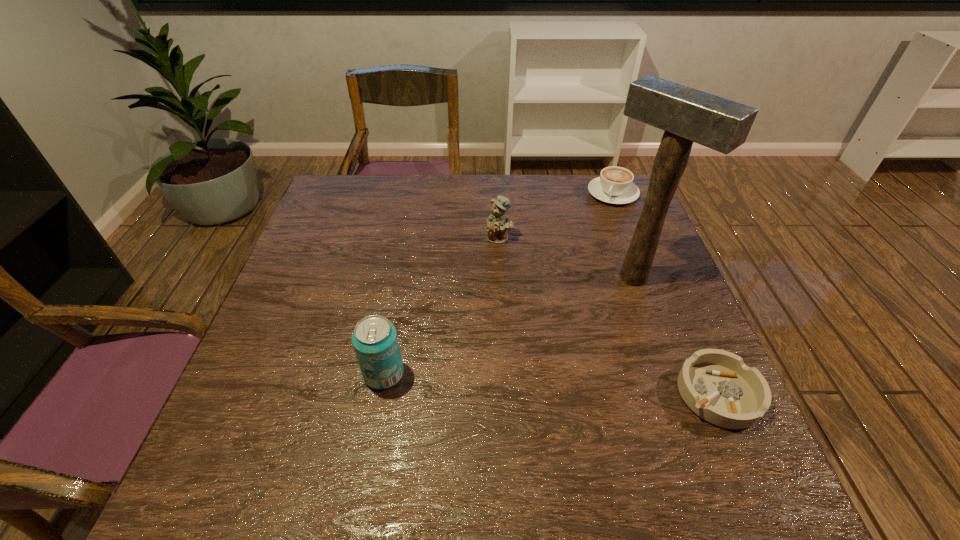
Find the location of a particular element. The height and width of the screenshot is (540, 960). free space located on the striking surface of the mallet is located at coordinates (558, 337).

Where is `free location located 0.360m on the striking surface of the mallet`? This screenshot has height=540, width=960. free location located 0.360m on the striking surface of the mallet is located at coordinates (502, 381).

Where is `blank space located on the striking surface of the mallet`? The height and width of the screenshot is (540, 960). blank space located on the striking surface of the mallet is located at coordinates (569, 328).

I want to click on blank space located 0.170m on the front-facing side of the fourth object from right to left, so click(501, 289).

Locate an element on the screen. Image resolution: width=960 pixels, height=540 pixels. free space located on the front-facing side of the fourth object from right to left is located at coordinates (504, 353).

Where is `vacant space situated 0.050m on the front-facing side of the fourth object from right to left`? vacant space situated 0.050m on the front-facing side of the fourth object from right to left is located at coordinates tap(500, 257).

Find the location of a particular element. The height and width of the screenshot is (540, 960). free space located 0.400m on the side of the cappuccino with the handle is located at coordinates (560, 290).

Find the location of a particular element. The width and height of the screenshot is (960, 540). vacant space located 0.080m on the side of the cappuccino with the handle is located at coordinates (598, 220).

Find the location of a particular element. The height and width of the screenshot is (540, 960). vacant space located on the side of the cappuccino with the handle is located at coordinates (568, 275).

Image resolution: width=960 pixels, height=540 pixels. What are the coordinates of `object at the far edge` in the screenshot? It's located at (615, 185).